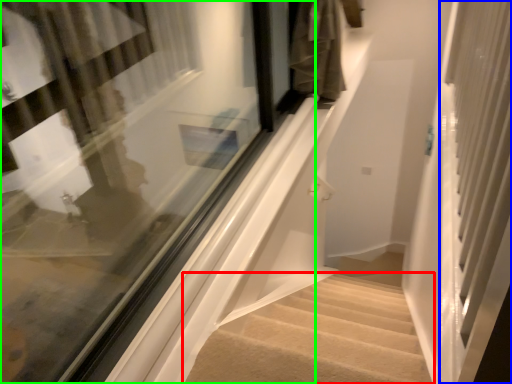
Question: Based on their relative distances, which object is nearer to stairs (highlighted by a red box)? Choose from screen door (highlighted by a blue box) and window (highlighted by a green box).

Choices:
 (A) screen door
 (B) window

Answer: (A)